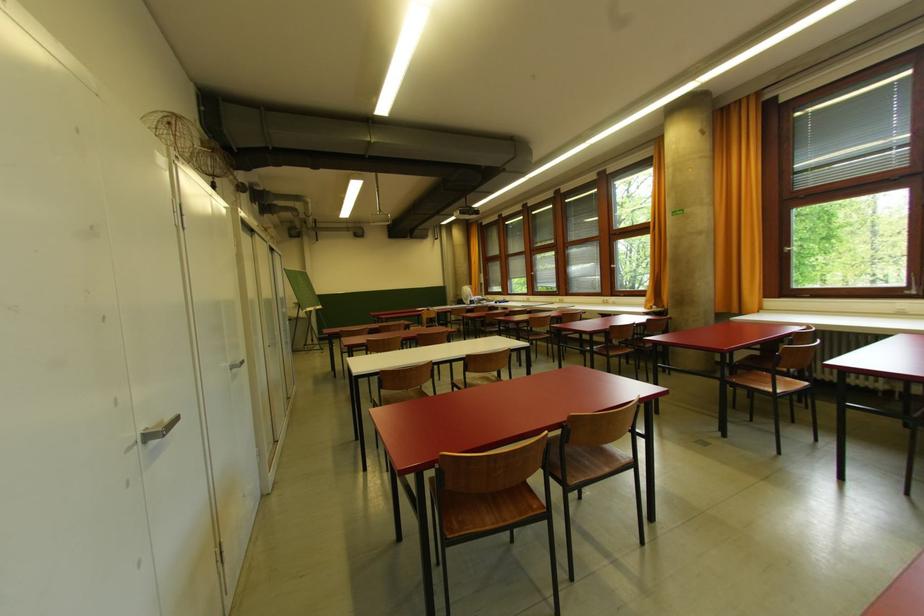
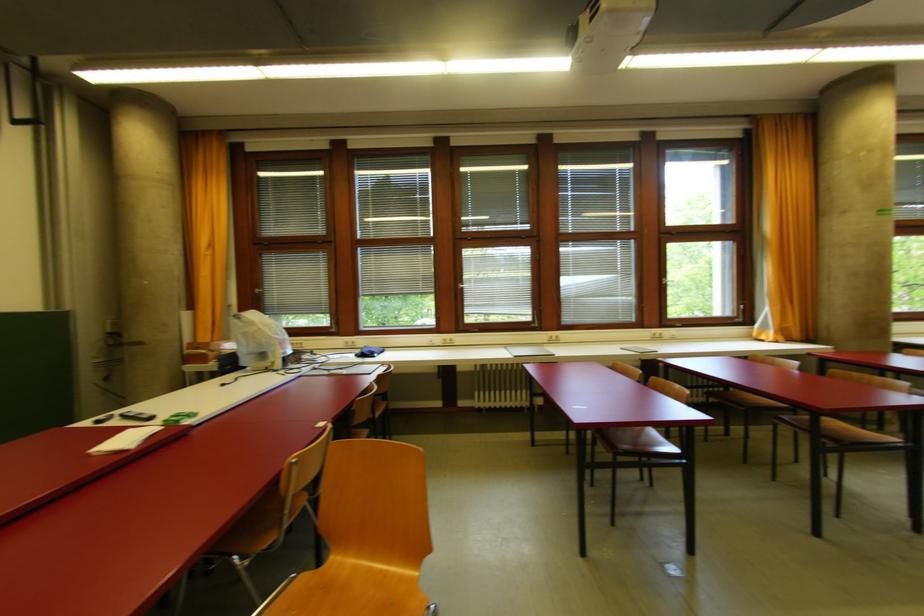
The point at (x=535, y=275) is marked in the first image. Where is the corresponding point in the second image?

(465, 288)